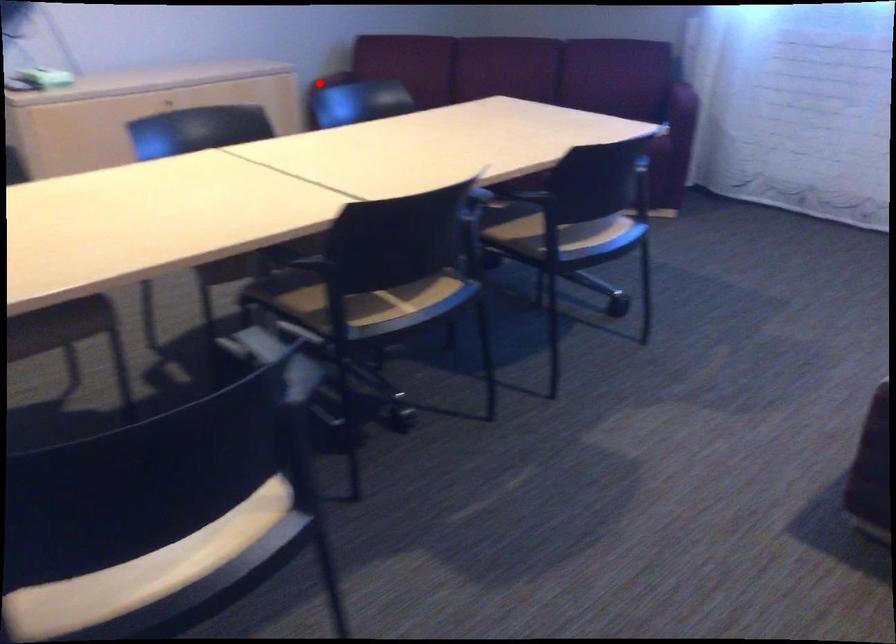
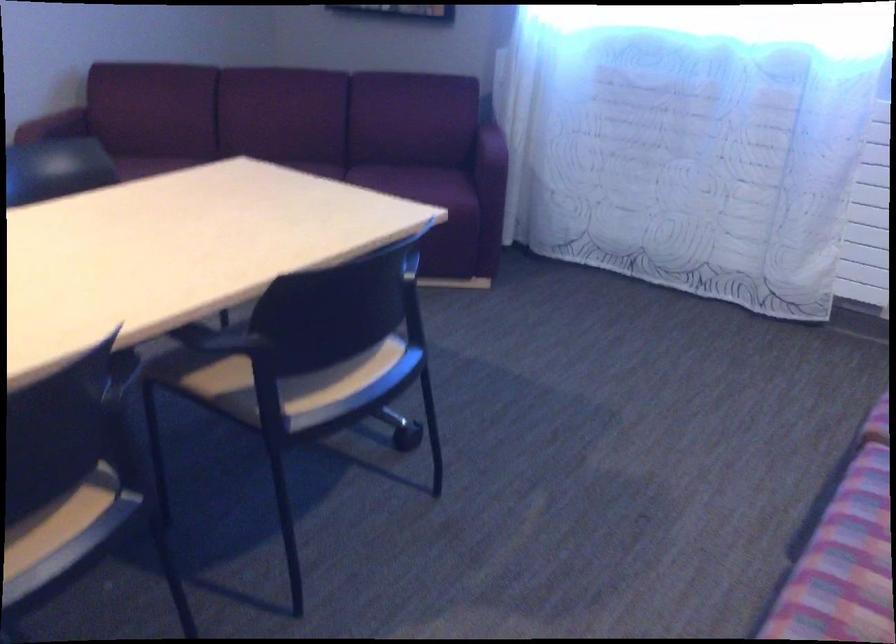
Question: I am providing you with two images of the same scene from different viewpoints. Image1 has a red point marked. In image2, the corresponding 3D location appears at what relative position? Reply with the corresponding letter.

Choices:
 (A) Closer
 (B) Farther

Answer: (A)